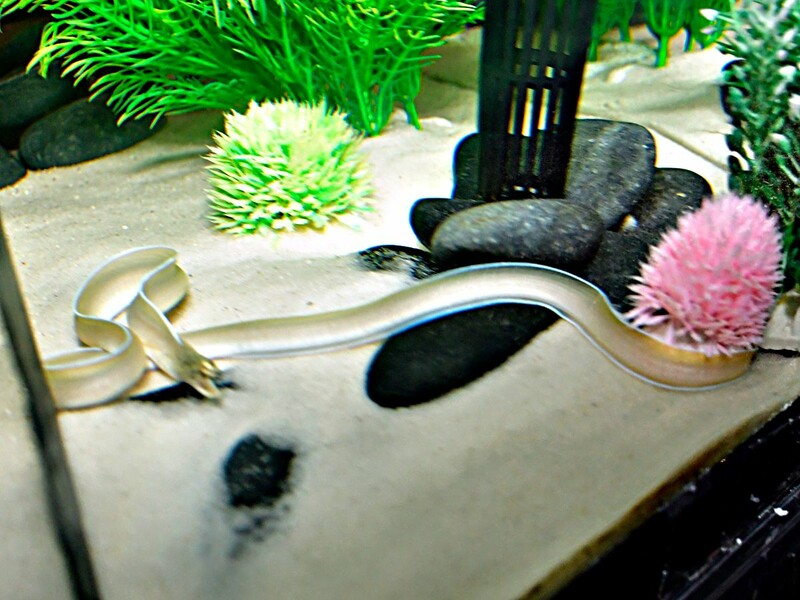
The image size is (800, 600). I want to click on corner of fish tank, so click(40, 410).